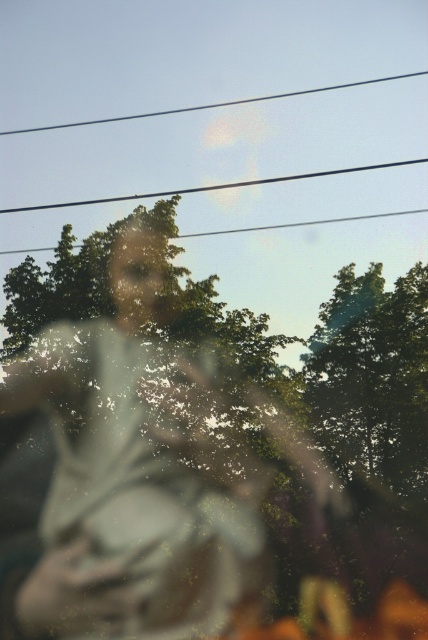
Based on the photo, you are a photographer trying to capture a clear shot of the translucent glass figure at center and the smooth wire at upper center. Based on the scene description, which object is positioned lower in the image?

The translucent glass figure at center is positioned below the smooth wire at upper center, so the translucent glass figure at center is lower in the image.

You are a photographer analyzing the image. You notice two wires in the upper center area. Which wire, the clear wire at upper center or the smooth wire at upper center, is shorter?

The clear wire at upper center is shorter than the smooth wire at upper center.

Consider the image. You are trying to identify the position of the clear wire at upper center in the image. According to the coordinates provided, where exactly is it located?

The clear wire at upper center is located at point coordinates of 0.292 in the x axis and 0.498 in the y axis.